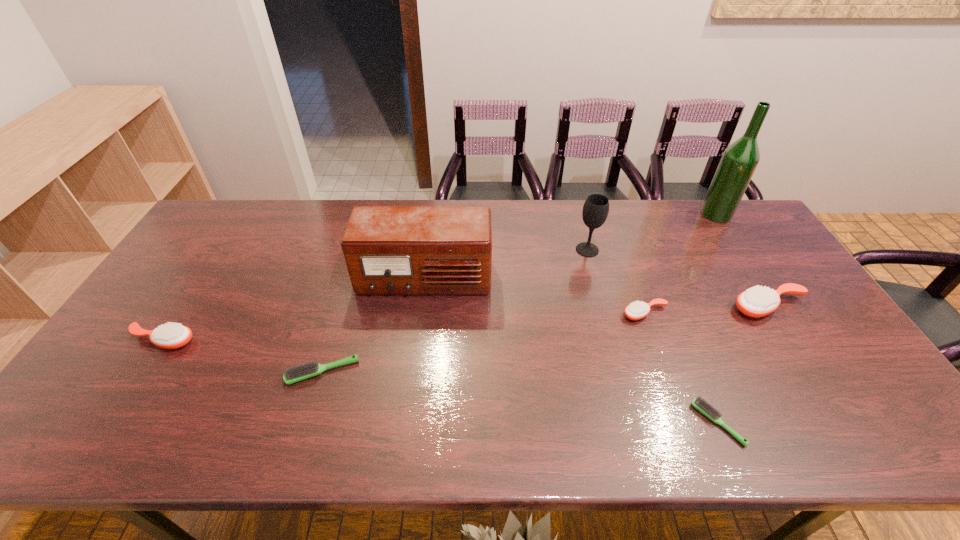
Locate an element on the screen. blank space that satisfies the following two spatial constraints: 1. on the back side of the smallest orange hairbrush; 2. on the left side of the tallest object is located at coordinates (610, 214).

Where is `free location that satisfies the following two spatial constraints: 1. on the back side of the smallest orange hairbrush; 2. on the left side of the fifth shortest object`? free location that satisfies the following two spatial constraints: 1. on the back side of the smallest orange hairbrush; 2. on the left side of the fifth shortest object is located at coordinates (642, 307).

Find the location of a particular element. The height and width of the screenshot is (540, 960). vacant space that satisfies the following two spatial constraints: 1. on the front-facing side of the shortest hairbrush; 2. on the right side of the radio receiver is located at coordinates (406, 423).